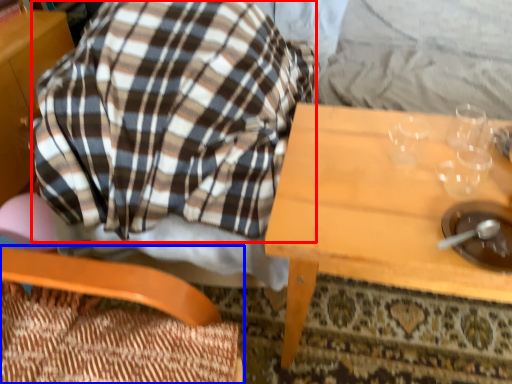
Question: Which object appears closest to the camera in this image, flannel (highlighted by a red box) or chair (highlighted by a blue box)?

Choices:
 (A) flannel
 (B) chair

Answer: (B)